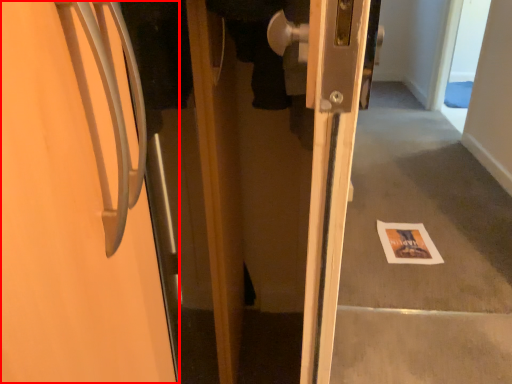
Question: In this image, where is door (annotated by the red box) located relative to postcard?

Choices:
 (A) right
 (B) left

Answer: (B)